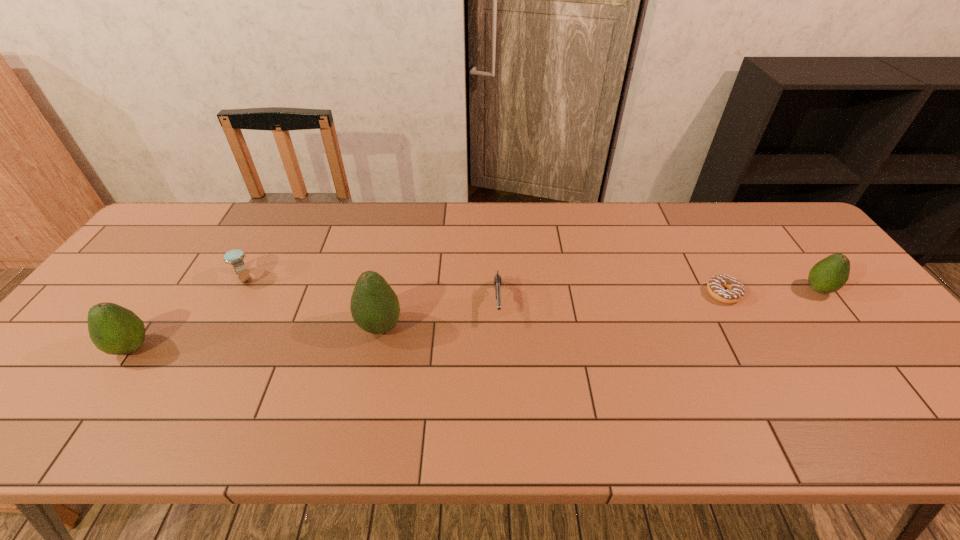
What are the coordinates of `vacant space at the near edge` in the screenshot? It's located at (567, 384).

In the image, there is a desktop. At what (x,y) coordinates should I click in order to perform the action: click on vacant space at the left edge. Please return your answer as a coordinate pair (x, y). This screenshot has height=540, width=960. Looking at the image, I should click on (153, 277).

This screenshot has width=960, height=540. I want to click on vacant space at the far left corner of the desktop, so click(x=198, y=204).

The image size is (960, 540). I want to click on vacant point at the far right corner, so click(787, 214).

I want to click on free space between the third shortest object and the shortest object, so click(484, 286).

Identify the location of empty space that is in between the second tallest avocado and the shortest object. (427, 321).

Where is `vacant space that is in between the second shortest avocado and the doughnut`? The width and height of the screenshot is (960, 540). vacant space that is in between the second shortest avocado and the doughnut is located at coordinates (427, 321).

The image size is (960, 540). In order to click on vacant area that lies between the leftmost object and the third shortest object in this screenshot , I will do pos(188,313).

At what (x,y) coordinates should I click in order to perform the action: click on vacant space that's between the fifth object from right to left and the second object from right to left. Please return your answer as a coordinate pair (x, y). Looking at the image, I should click on (484, 286).

I want to click on vacant area between the second avocado from left to right and the watch, so click(312, 302).